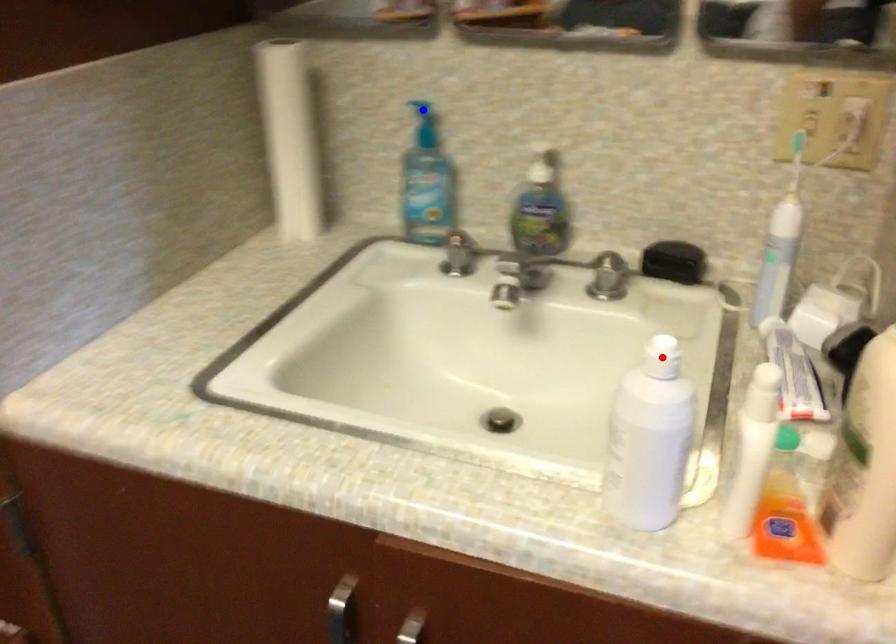
Question: Which of the two points in the image is closer to the camera?

Choices:
 (A) Blue point is closer.
 (B) Red point is closer.

Answer: (B)